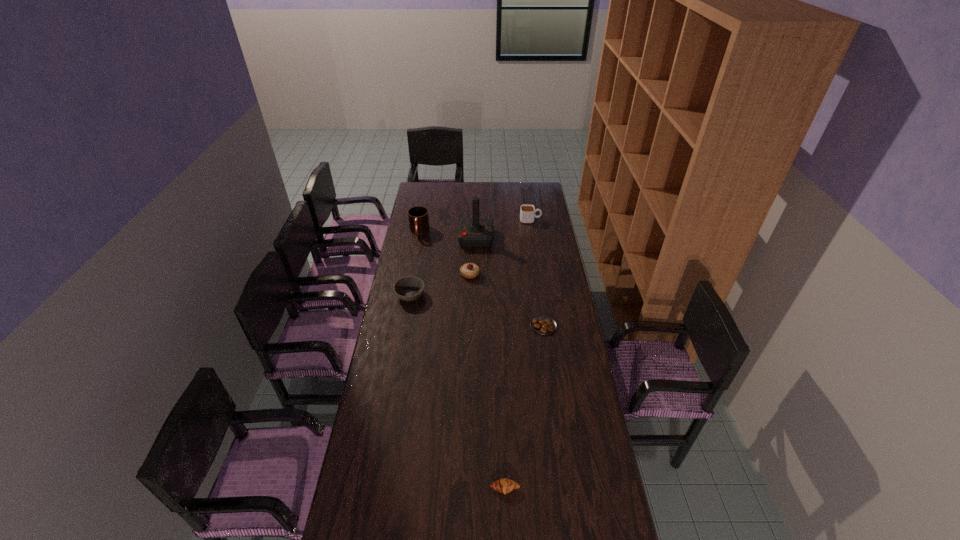
The width and height of the screenshot is (960, 540). What are the coordinates of `vacant area that lies between the fourth farthest object and the fifth tallest object` in the screenshot? It's located at [440, 285].

What are the coordinates of `vacant region between the second pastry from right to left and the bowl` in the screenshot? It's located at 458,392.

You are a GUI agent. You are given a task and a screenshot of the screen. Output one action in this format:
    pyautogui.click(x=<x>, y=<y>)
    Task: Click on the vacant point located between the second tallest object and the leftmost pastry
    
    Given the screenshot: What is the action you would take?
    pyautogui.click(x=444, y=253)

Select which object is the second closest to the second tallest object. Please provide its 2D coordinates. Your answer should be formatted as a tuple, i.e. [(x, y)], where the tuple contains the x and y coordinates of a point satisfying the conditions above.

[(469, 270)]

At what (x,y) coordinates should I click in order to perform the action: click on object that stands as the fourth closest to the mug. Please return your answer as a coordinate pair (x, y). Looking at the image, I should click on (527, 211).

I want to click on the third closest pastry to the fifth farthest object, so click(505, 485).

This screenshot has height=540, width=960. What are the coordinates of `pastry that is the second closest one to the rightmost pastry` in the screenshot? It's located at pos(505,485).

The image size is (960, 540). What are the coordinates of `vacant space that satisfies the following two spatial constraints: 1. on the back side of the fourth nearest object; 2. on the right side of the bowl` in the screenshot? It's located at (414, 274).

The image size is (960, 540). Find the location of `vacant point that satisfies the following two spatial constraints: 1. on the side with the handle of the cup; 2. on the front-facing side of the nearest object`. vacant point that satisfies the following two spatial constraints: 1. on the side with the handle of the cup; 2. on the front-facing side of the nearest object is located at coordinates (572, 489).

Locate an element on the screen. free space that satisfies the following two spatial constraints: 1. on the side with the handle of the cup; 2. on the side of the mug with the handle is located at coordinates (532, 232).